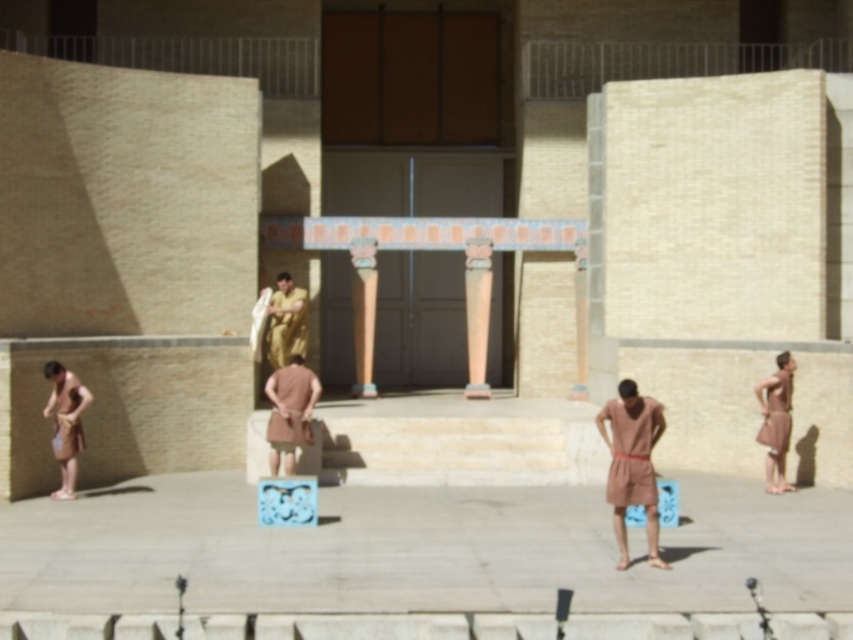
Based on the photo, you are an event organizer arranging a historical reenactment. You need to determine if the brown cloth at center can be draped over the smooth beige column at center. Based on their sizes, can the cloth cover the column completely?

The brown cloth at center is larger in width than the smooth beige column at center, so the cloth can be draped over the column to cover it completely.

You are an archaeologist examining the ancient structure and its surrounding artifacts. You notice two items of fabric near the base of the columns. The first is a brown matte loincloth at lower left, and the second is a brown fabric at right. Based on their positions and the available space, which item has a greater width?

The brown matte loincloth at lower left might be wider than brown fabric at right.

You are an archaeologist examining an ancient relief sculpture. You notice a point marked at coordinates (x=65, y=422). Based on the scene description, what object is located at this point?

The point at (x=65, y=422) marks the brown matte loincloth at lower left.